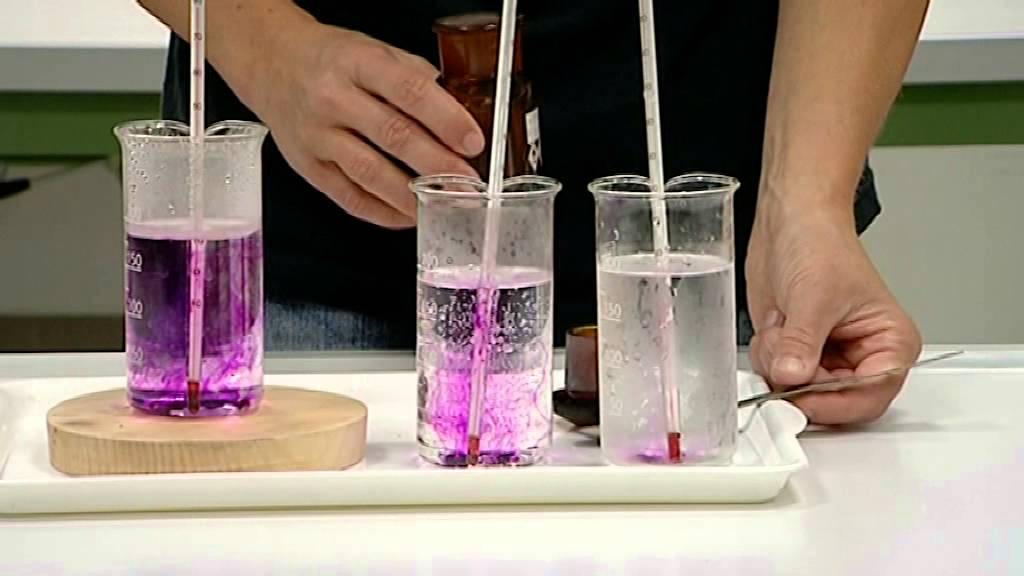
At what (x,y) coordinates should I click in order to perform the action: click on white table. Please return your answer as a coordinate pair (x, y). The height and width of the screenshot is (576, 1024). Looking at the image, I should click on [x=413, y=551].